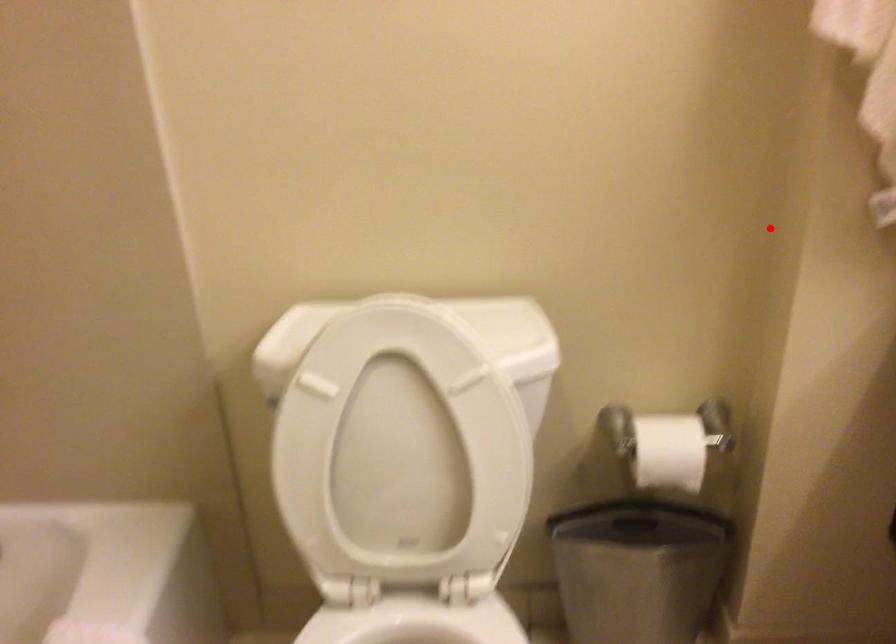
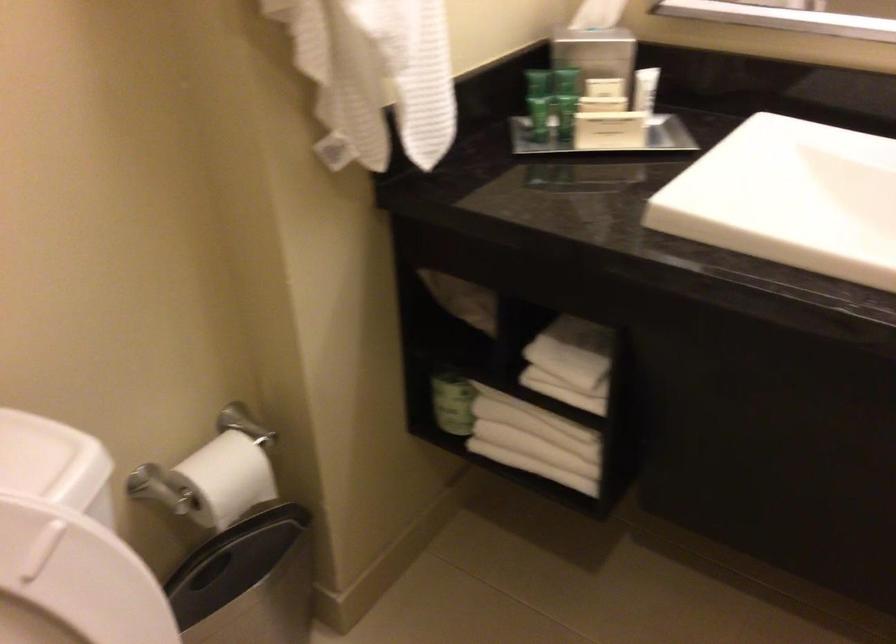
Question: I am providing you with two images of the same scene from different viewpoints. Given a red point in image1, look at the same physical point in image2. Is it:

Choices:
 (A) Closer to the viewpoint
 (B) Farther from the viewpoint

Answer: (A)